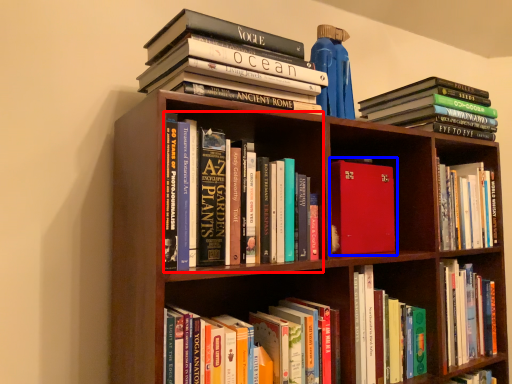
Question: Which of the following is the farthest to the observer, book (highlighted by a red box) or book (highlighted by a blue box)?

Choices:
 (A) book
 (B) book

Answer: (B)